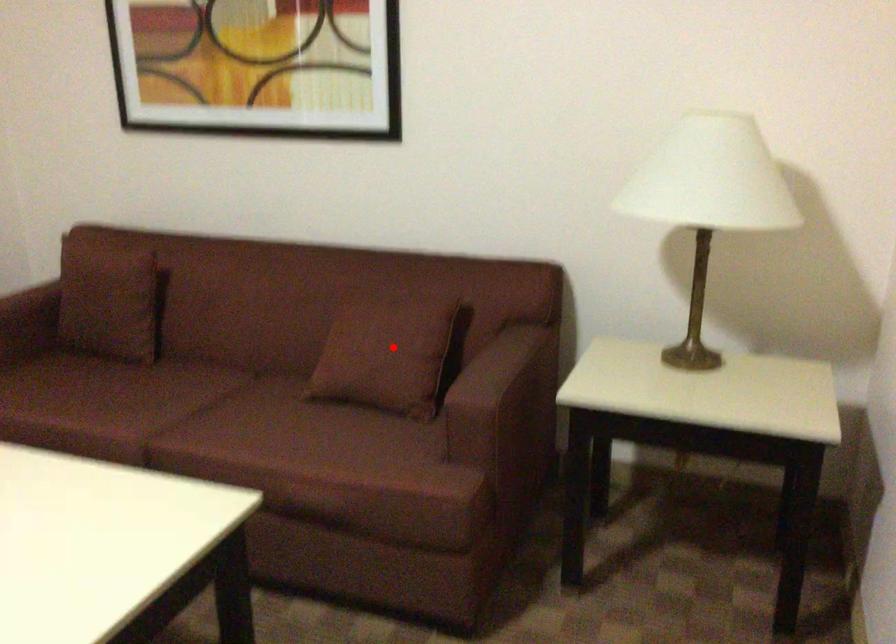
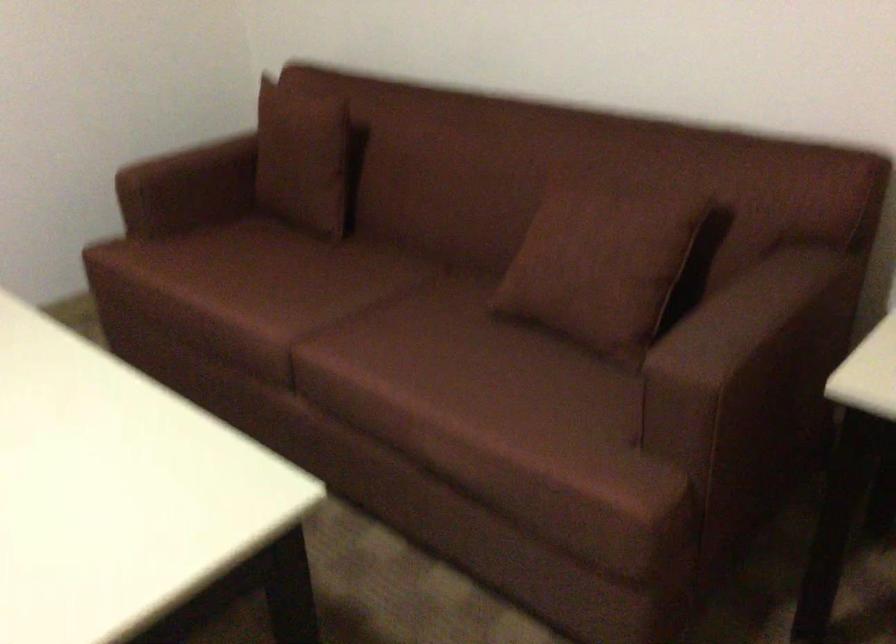
In the second image, find the point that corresponds to the highlighted location in the first image.

(600, 263)